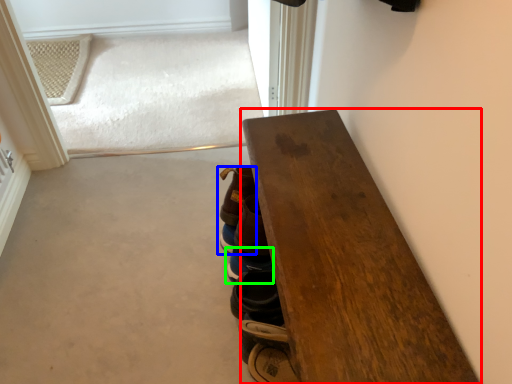
Question: Estimate the real-world distances between objects in this image. Which object is closer to table (highlighted by a red box), footwear (highlighted by a blue box) or footwear (highlighted by a green box)?

Choices:
 (A) footwear
 (B) footwear

Answer: (A)